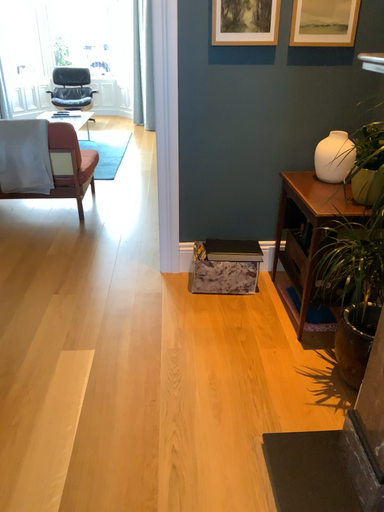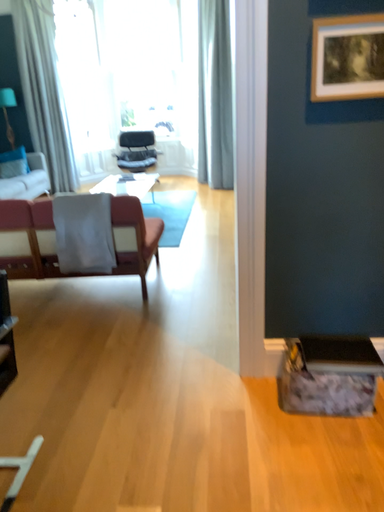
Question: Which way did the camera rotate in the video?

Choices:
 (A) rotated right
 (B) rotated left

Answer: (B)